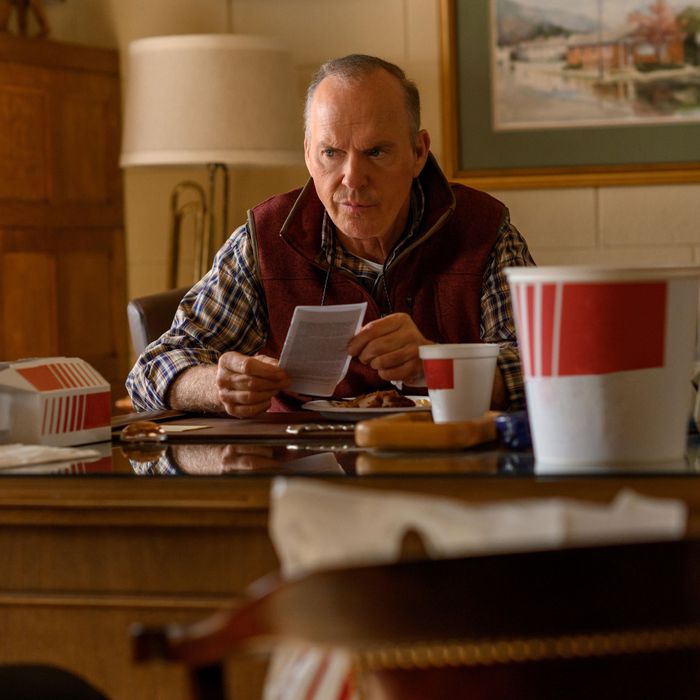
The width and height of the screenshot is (700, 700). I want to click on white plate, right of center, so click(x=371, y=407).